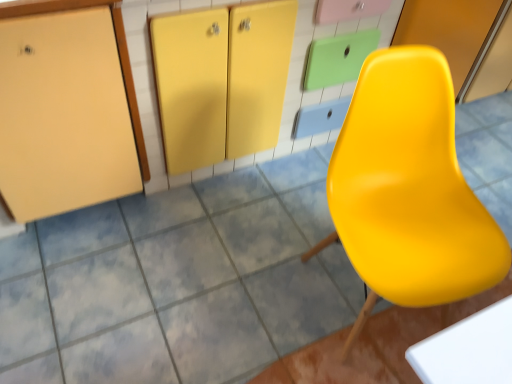
This screenshot has width=512, height=384. What do you see at coordinates (409, 189) in the screenshot?
I see `yellow matte plastic chair at right` at bounding box center [409, 189].

I want to click on yellow matte plastic chair at right, so click(x=409, y=189).

Locate an element on the screen. Image resolution: width=512 pixels, height=384 pixels. yellow matte plastic chair at right is located at coordinates (409, 189).